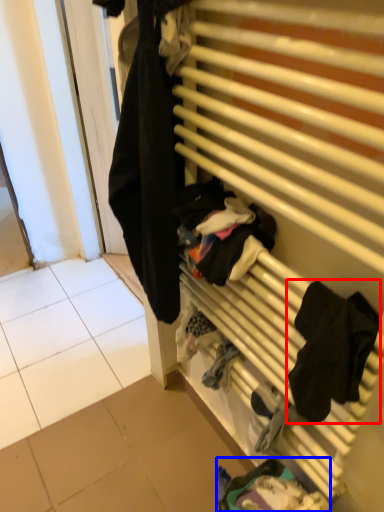
Question: Which object is further to the camera taking this photo, clothing (highlighted by a red box) or clothing (highlighted by a blue box)?

Choices:
 (A) clothing
 (B) clothing

Answer: (B)